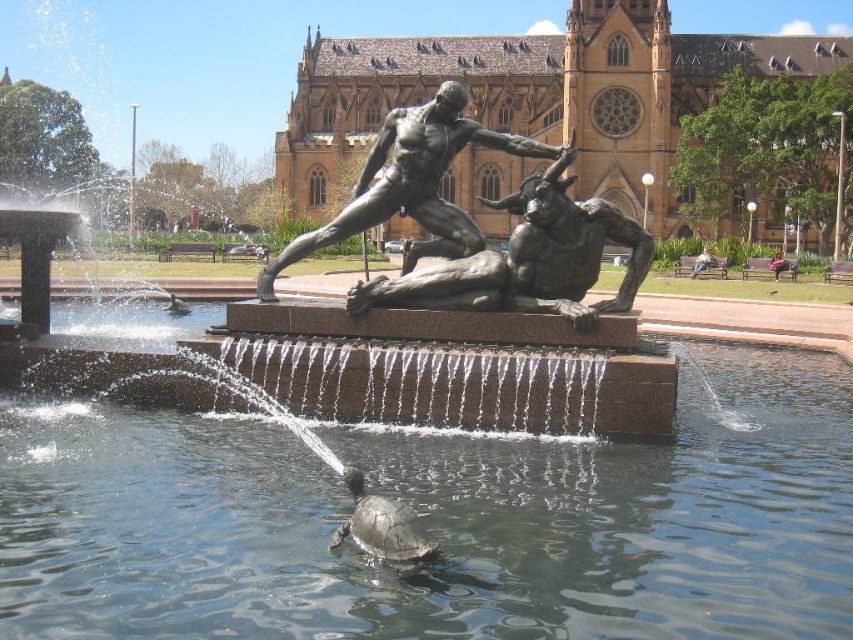
You are standing at the center of the fountain and want to place a decorative rock at the exact location of the bronze statue at center. What are the coordinates where you should place it?

The bronze statue at center is located at coordinates point (x=527, y=259), so you should place the decorative rock at point (x=527, y=259).

You are a maintenance worker inspecting the fountain. You need to clean the bronze statue at center and the shiny dark gray tortoise at center. Which object should you clean first if you want to start from the lower part of the fountain?

The shiny dark gray tortoise at center should be cleaned first because it is located below the bronze statue at center.

You are a photographer wanting to capture both the shiny dark gray tortoise at center and the light brown wooden bench at center right in the same frame. Based on their positions, which object should you adjust your camera to focus on first to ensure both are in the shot?

The shiny dark gray tortoise at center is positioned on the left side of light brown wooden bench at center right. To include both in the frame, focus on the shiny dark gray tortoise at center first as it is closer to the left edge, then adjust to ensure the light brown wooden bench at center right is also visible.